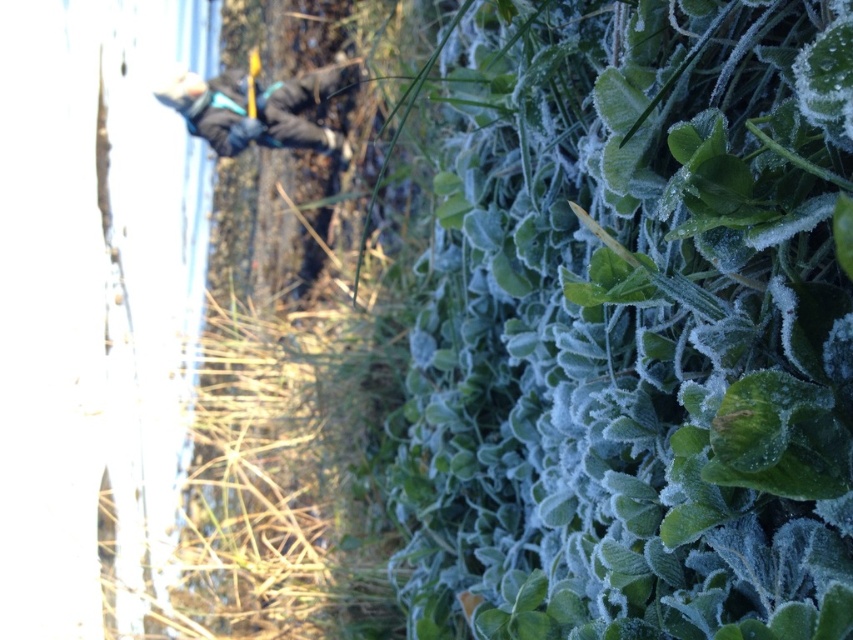
Question: Is green frosted leaves at lower right to the right of dark gray jacket at upper left from the viewer's perspective?

Choices:
 (A) no
 (B) yes

Answer: (B)

Question: Is green frosted leaves at lower right below dark gray jacket at upper left?

Choices:
 (A) no
 (B) yes

Answer: (B)

Question: Is green frosted leaves at lower right below dark gray jacket at upper left?

Choices:
 (A) no
 (B) yes

Answer: (B)